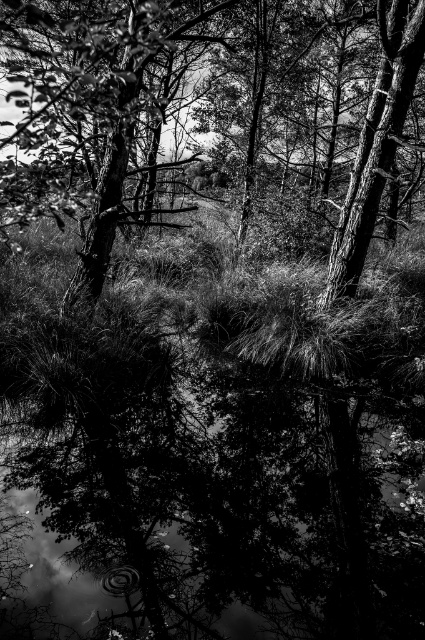
Question: Can you confirm if smooth bark tree at center is positioned above smooth bark tree at upper right?

Choices:
 (A) yes
 (B) no

Answer: (A)

Question: Which point is closer to the camera taking this photo?

Choices:
 (A) (325, 292)
 (B) (348, 285)
 (C) (116, 508)

Answer: (C)

Question: Can you confirm if smooth bark tree at center is smaller than smooth bark tree at upper right?

Choices:
 (A) yes
 (B) no

Answer: (B)

Question: Which of the following is the closest to the observer?

Choices:
 (A) transparent water at center
 (B) smooth bark tree at center
 (C) smooth bark tree at upper right

Answer: (A)

Question: Which object is farther from the camera taking this photo?

Choices:
 (A) transparent water at center
 (B) smooth bark tree at center

Answer: (B)

Question: From the image, what is the correct spatial relationship of transparent water at center in relation to smooth bark tree at center?

Choices:
 (A) right
 (B) left

Answer: (A)